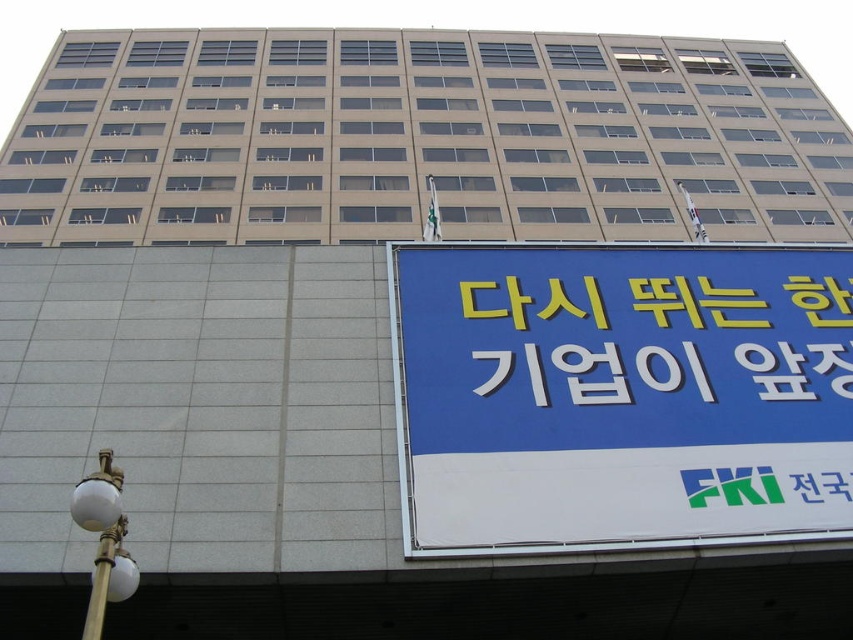
Question: Which point is closer to the camera?

Choices:
 (A) (525, 477)
 (B) (815, 305)
 (C) (102, 620)
 (D) (103, 513)

Answer: (C)

Question: Does blue matte signboard at lower right appear over gold metallic streetlight at lower left?

Choices:
 (A) no
 (B) yes

Answer: (B)

Question: Can you confirm if blue matte signboard at lower right is positioned below yellow plastic sign at center?

Choices:
 (A) no
 (B) yes

Answer: (B)

Question: Does blue matte signboard at lower right lie in front of yellow plastic sign at center?

Choices:
 (A) yes
 (B) no

Answer: (A)

Question: Considering the real-world distances, which object is closest to the yellow plastic sign at center?

Choices:
 (A) blue matte signboard at lower right
 (B) metallic pole at lower left

Answer: (A)

Question: Among these points, which one is nearest to the camera?

Choices:
 (A) (686, 316)
 (B) (776, 515)
 (C) (108, 541)
 (D) (114, 536)

Answer: (C)